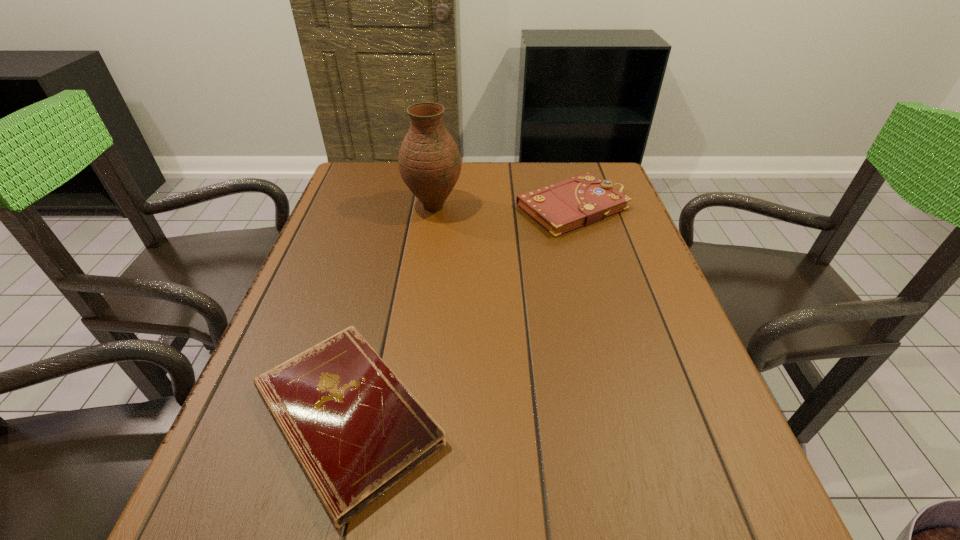
Where is `object that is at the near edge`? object that is at the near edge is located at coordinates (356, 430).

Where is `object located at the left edge`? This screenshot has width=960, height=540. object located at the left edge is located at coordinates (356, 430).

Where is `object that is at the right edge`? Image resolution: width=960 pixels, height=540 pixels. object that is at the right edge is located at coordinates (581, 200).

You are a GUI agent. You are given a task and a screenshot of the screen. Output one action in this format:
    pyautogui.click(x=<x>, y=<y>)
    Task: Click on the object situated at the near left corner
    
    Given the screenshot: What is the action you would take?
    pyautogui.click(x=356, y=430)

In order to click on object present at the far right corner in this screenshot , I will do `click(581, 200)`.

Image resolution: width=960 pixels, height=540 pixels. In order to click on vacant region at the far edge of the desktop in this screenshot , I will do `click(483, 173)`.

What are the coordinates of `vacant area at the left edge` in the screenshot? It's located at (342, 265).

Identify the location of free space at the right edge. This screenshot has width=960, height=540. (582, 239).

This screenshot has height=540, width=960. In order to click on blank space at the far left corner of the desktop in this screenshot , I will do `click(345, 195)`.

The image size is (960, 540). I want to click on free region at the near left corner of the desktop, so click(202, 497).